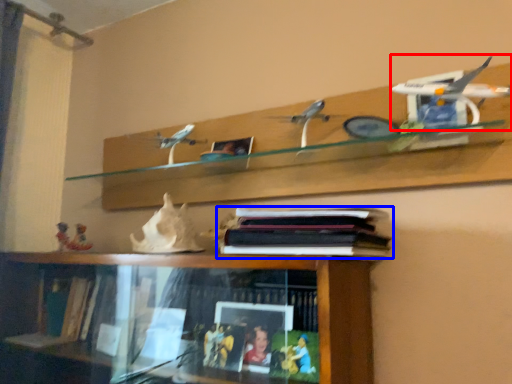
Question: Among these objects, which one is farthest to the camera, aircraft model (highlighted by a red box) or book (highlighted by a blue box)?

Choices:
 (A) aircraft model
 (B) book

Answer: (B)